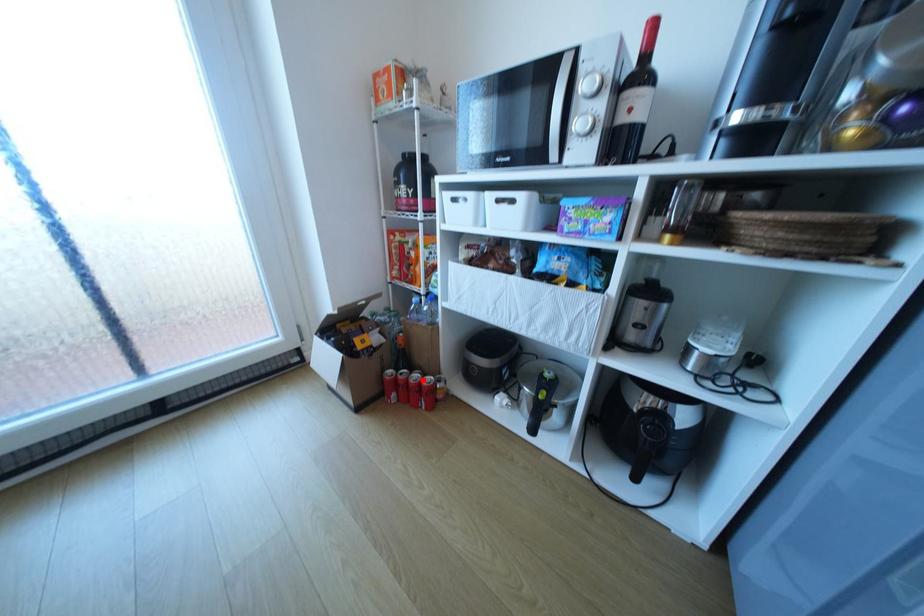
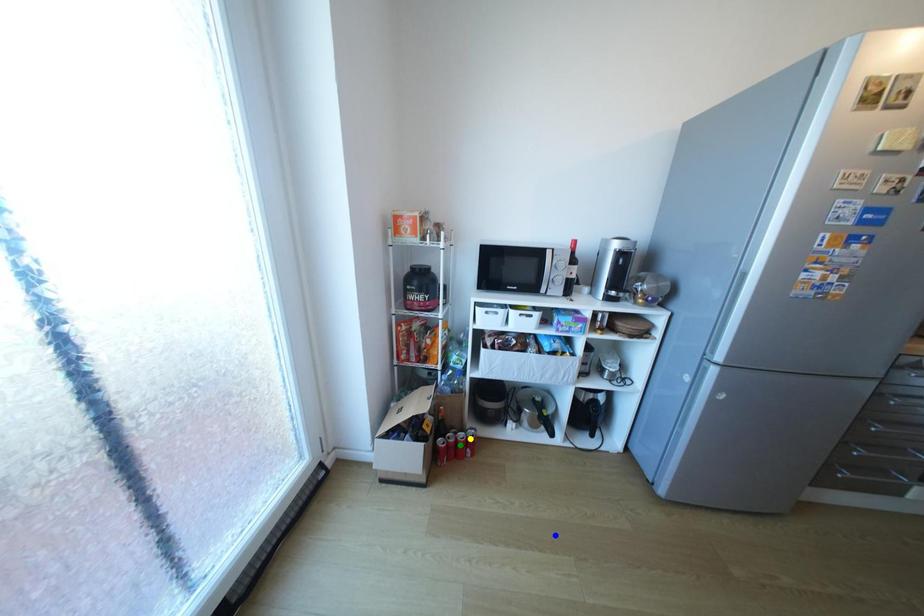
Question: I am providing you with two images of the same scene from different viewpoints. A red point is marked on the first image. You are given multiple points on the second image. Which spot in image 2 lines up with the point in image 1?

Choices:
 (A) yellow point
 (B) blue point
 (C) green point

Answer: (A)